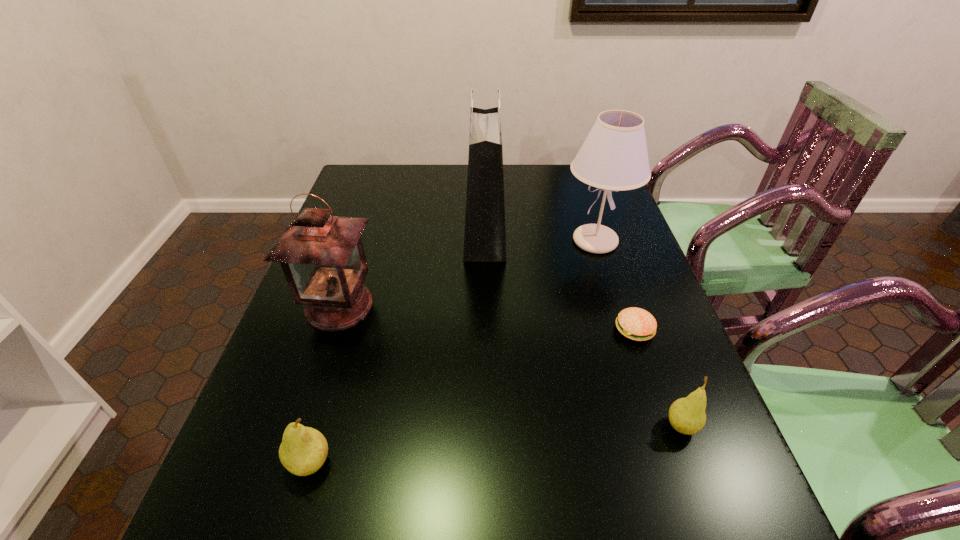
What are the coordinates of `location for an additional pear to make spacing equal` in the screenshot? It's located at (502, 444).